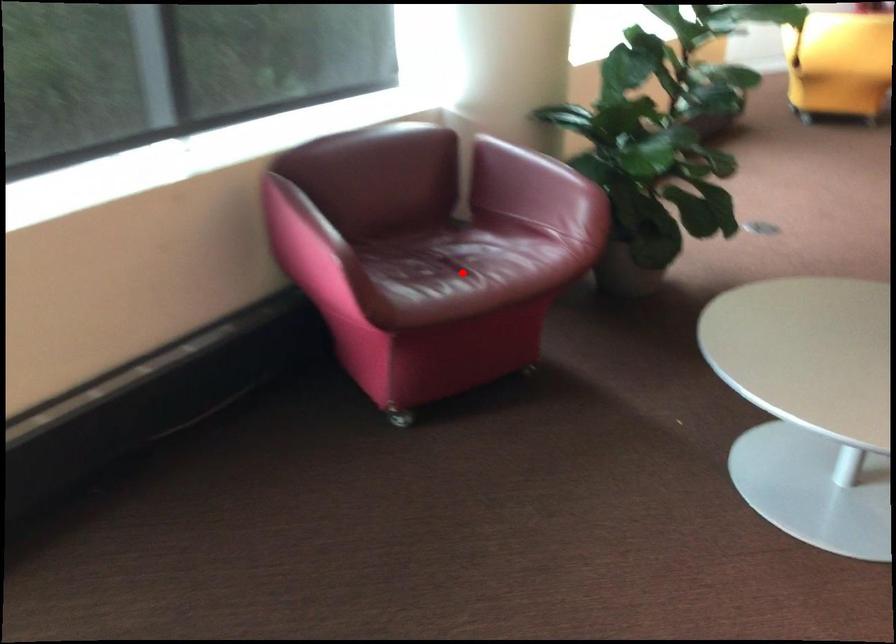
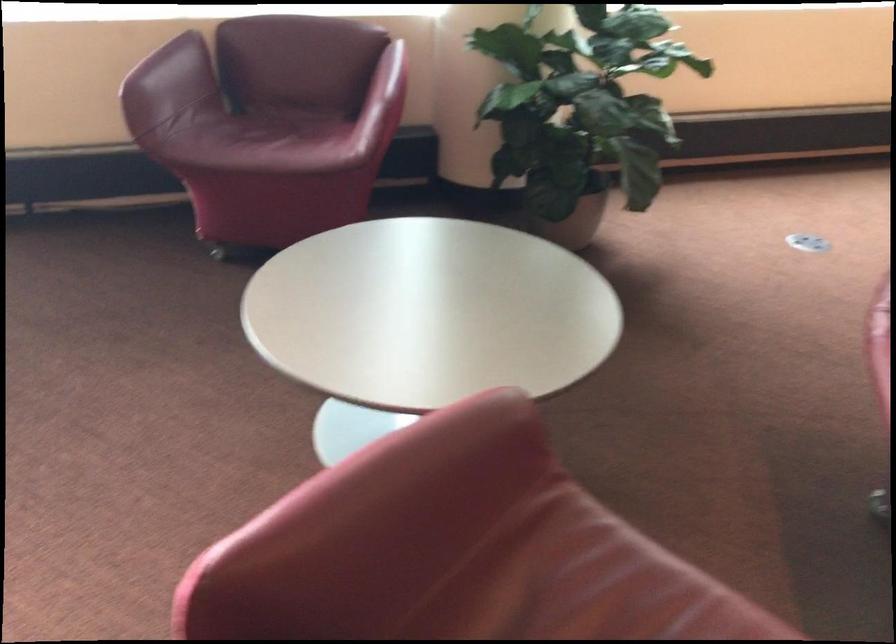
Question: I am providing you with two images of the same scene from different viewpoints. Image1 has a red point marked. In image2, the corresponding 3D location appears at what relative position? Reply with the corresponding letter.

Choices:
 (A) Closer
 (B) Farther

Answer: (B)